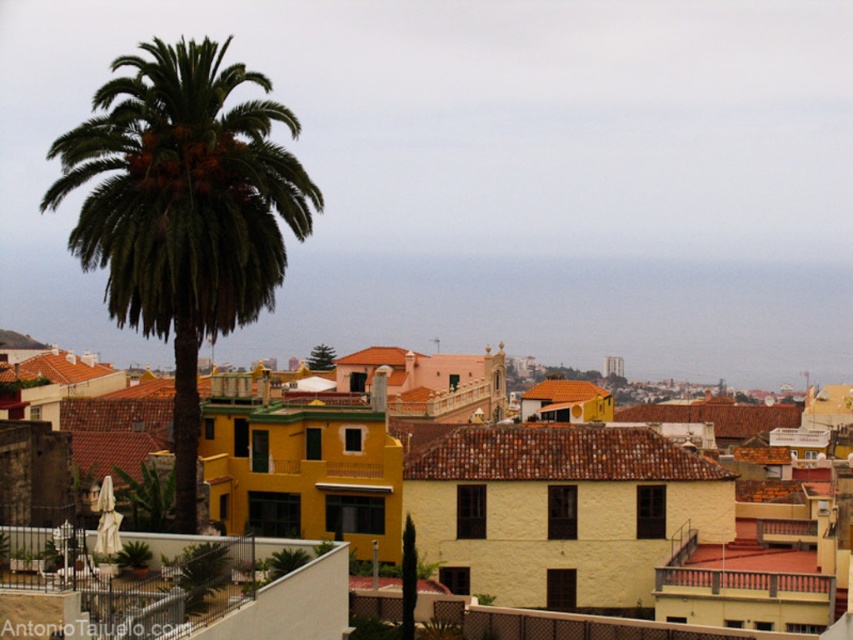
You are standing in the coastal town scene and want to take a photo of the green leafy palm at left. If you move 0.1 units to the right from your current position, will the palm still be in your frame? Assume your camera has a fixed field of view covering from x 0.0 to 1.0 and y 0.0 to 1.0.

The green leafy palm at left is located at point 0.330 on the x axis. Moving 0.1 units to the right would shift your position, but since the palm is within the x range of 0.0 to 1.0, it will remain in the frame.